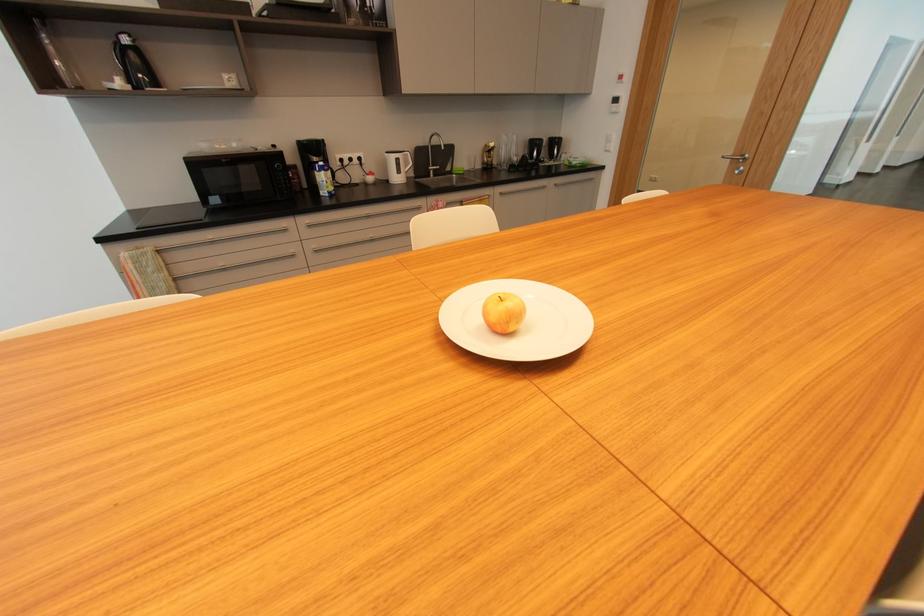
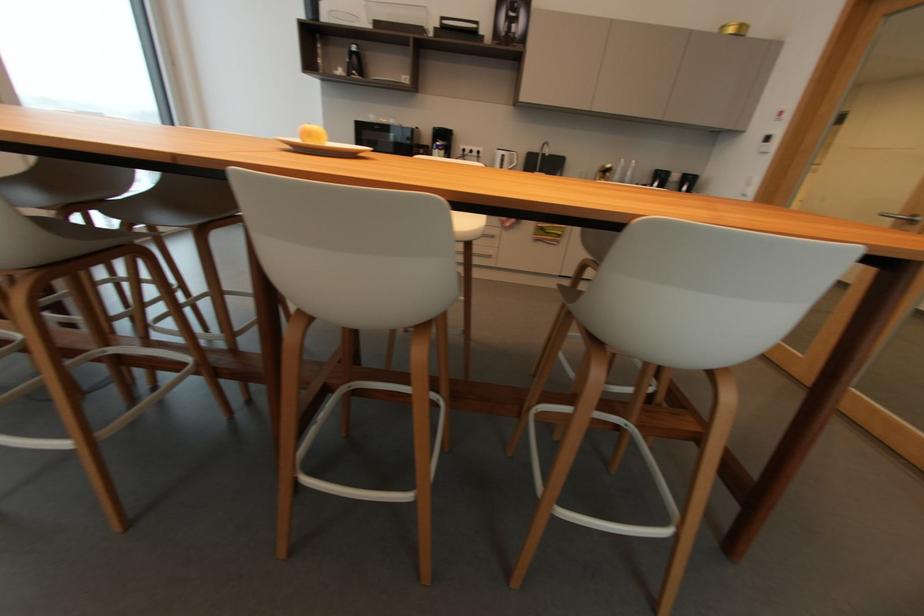
Locate, in the second image, the point that corresponds to point (733, 160) in the first image.

(896, 219)